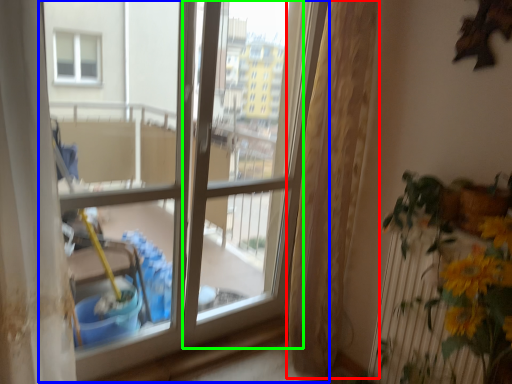
Question: Considering the real-world distances, which object is closest to curtain (highlighted by a red box)? window (highlighted by a blue box) or screen door (highlighted by a green box).

Choices:
 (A) window
 (B) screen door

Answer: (A)